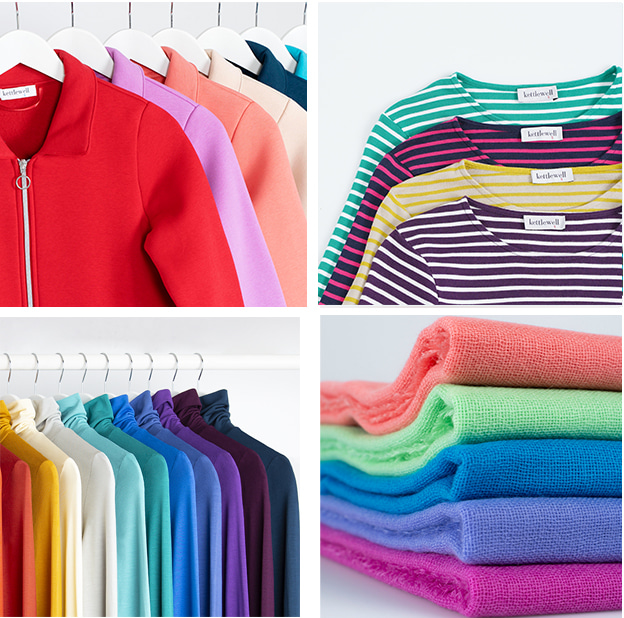
At what (x,y) coordinates should I click in order to perform the action: click on towel. Please return your answer as a coordinate pair (x, y). This screenshot has width=624, height=618. Looking at the image, I should click on (550, 580), (548, 538), (540, 476), (547, 420), (544, 360).